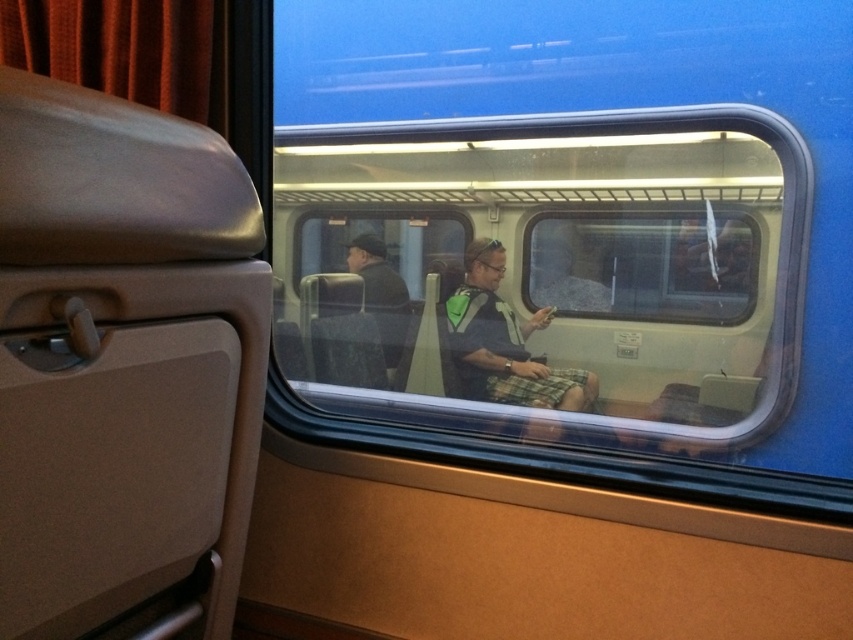
Who is higher up, transparent glass train window at center or green fabric backpack at center?

transparent glass train window at center is higher up.

Which is behind, point (505, 161) or point (585, 392)?

The point (505, 161) is more distant.

You are a GUI agent. You are given a task and a screenshot of the screen. Output one action in this format:
    pyautogui.click(x=<x>, y=<y>)
    Task: Click on the transparent glass train window at center
    
    Given the screenshot: What is the action you would take?
    [x=566, y=266]